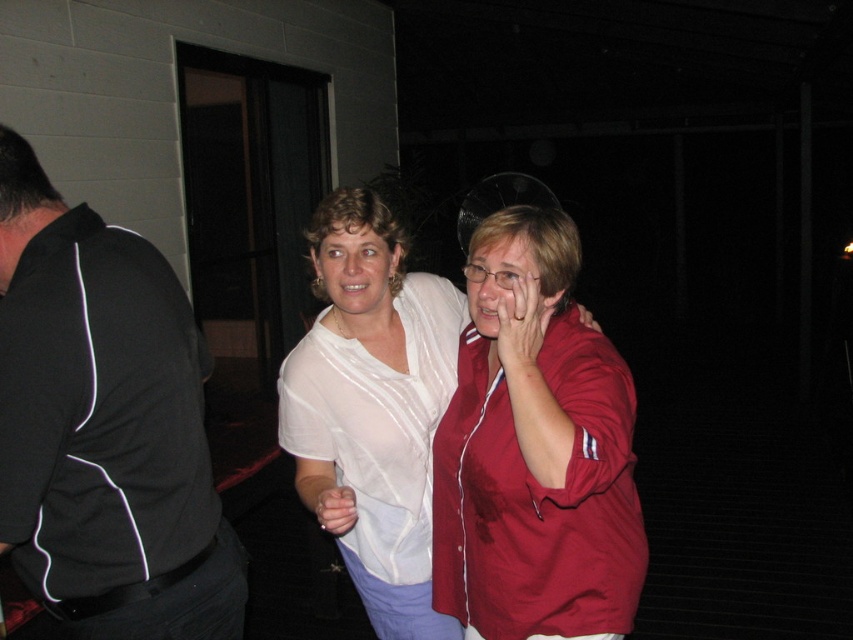
Question: Which point is farther to the camera?

Choices:
 (A) (154, 413)
 (B) (312, 488)

Answer: (B)

Question: Which of the following is the closest to the observer?

Choices:
 (A) (344, 516)
 (B) (28, 396)
 (C) (358, 561)
 (D) (521, 323)

Answer: (B)

Question: Is black fabric shirt at left positioned behind matte white hand at center?

Choices:
 (A) yes
 (B) no

Answer: (B)

Question: Which is nearer to the black fabric shirt at left?

Choices:
 (A) matte white hand at center
 (B) matte red shirt at center

Answer: (A)

Question: In this image, where is black fabric shirt at left located relative to matte red shirt at center?

Choices:
 (A) right
 (B) left

Answer: (B)

Question: Can you confirm if black fabric shirt at left is positioned below matte white hand at center?

Choices:
 (A) yes
 (B) no

Answer: (B)